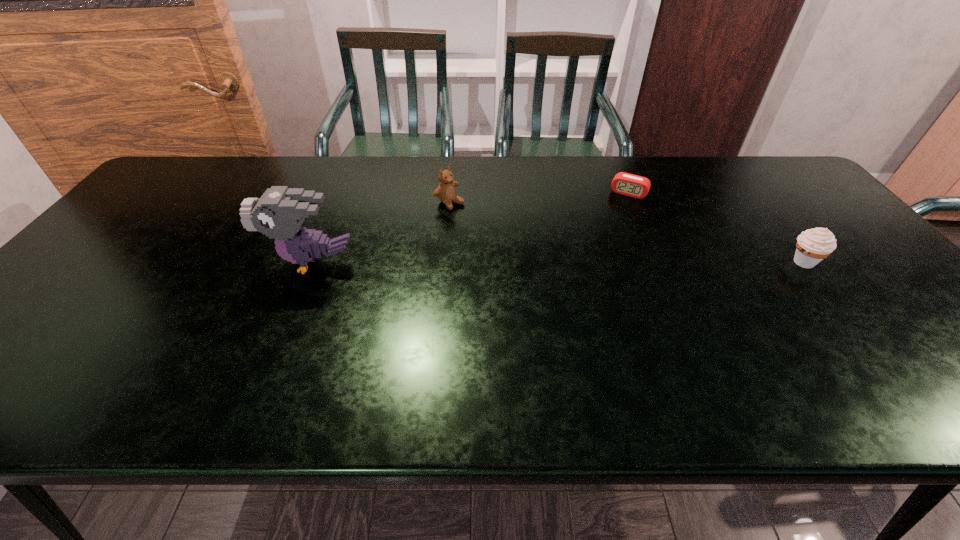
At what (x,y) coordinates should I click in order to perform the action: click on the leftmost object. Please return your answer as a coordinate pair (x, y). The height and width of the screenshot is (540, 960). Looking at the image, I should click on (279, 213).

Locate an element on the screen. the tallest object is located at coordinates (279, 213).

Where is `muffin`? Image resolution: width=960 pixels, height=540 pixels. muffin is located at coordinates (813, 245).

Locate an element on the screen. This screenshot has width=960, height=540. the shortest object is located at coordinates pyautogui.click(x=623, y=183).

Image resolution: width=960 pixels, height=540 pixels. I want to click on the second object from right to left, so pyautogui.click(x=623, y=183).

You are a GUI agent. You are given a task and a screenshot of the screen. Output one action in this format:
    pyautogui.click(x=<x>, y=<y>)
    Task: Click on the teddy bear
    The width and height of the screenshot is (960, 540).
    Given the screenshot: What is the action you would take?
    pyautogui.click(x=446, y=192)

Where is `vacant position located at the beak of the bird`? The height and width of the screenshot is (540, 960). vacant position located at the beak of the bird is located at coordinates (183, 262).

In order to click on vacant space located at the beak of the bird in this screenshot , I will do `click(183, 262)`.

Locate an element on the screen. The height and width of the screenshot is (540, 960). free region located 0.340m at the beak of the bird is located at coordinates (137, 262).

This screenshot has height=540, width=960. I want to click on free point located 0.050m on the left of the muffin, so click(x=768, y=262).